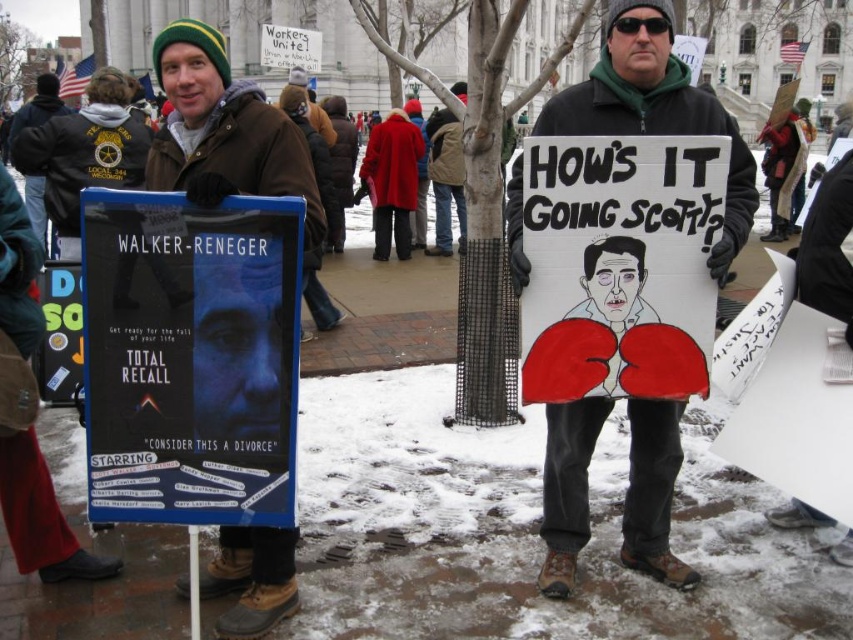
Who is positioned more to the left, matte black sign at center or brown leather jacket at center?

From the viewer's perspective, brown leather jacket at center appears more on the left side.

Locate an element on the screen. matte black sign at center is located at coordinates (654, 108).

Locate an element on the screen. matte black sign at center is located at coordinates (654, 108).

Who is positioned more to the right, blue cardboard poster at center-left or white cardboard sign at center?

Positioned to the right is white cardboard sign at center.

Which is behind, point (148, 280) or point (659, 324)?

Point (659, 324)

What are the coordinates of `blue cardboard poster at center-left` in the screenshot? It's located at (190, 356).

Who is taller, blue cardboard poster at center-left or matte black sign at center?

matte black sign at center

Is blue cardboard poster at center-left above matte black sign at center?

Incorrect, blue cardboard poster at center-left is not positioned above matte black sign at center.

This screenshot has height=640, width=853. Describe the element at coordinates (190, 356) in the screenshot. I see `blue cardboard poster at center-left` at that location.

Identify the location of blue cardboard poster at center-left. The width and height of the screenshot is (853, 640). tap(190, 356).